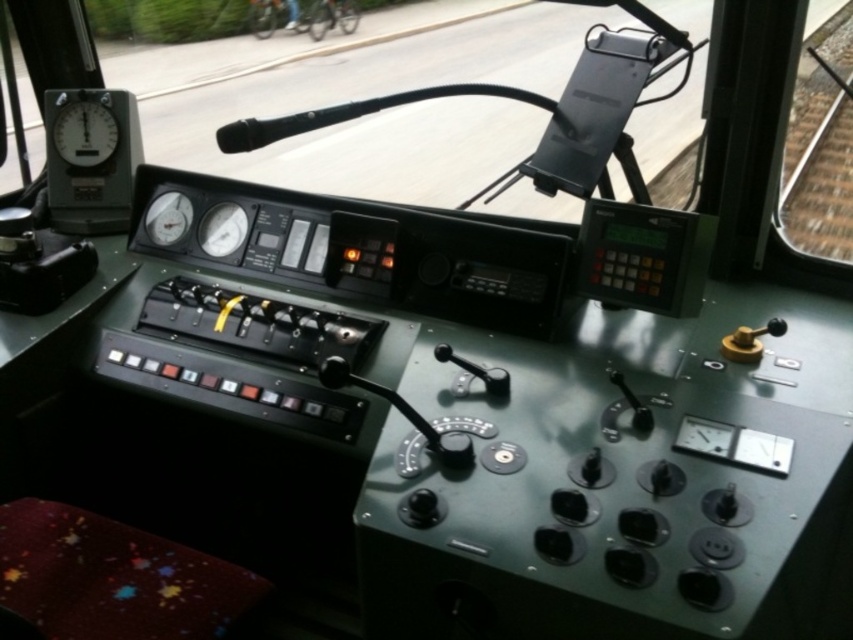
From the picture: You are a train engineer who needs to adjust both the matte black gauge at upper left and the yellow lever centrally. Given that you are standing in front of the control panel, can you reach both controls without moving your position?

The matte black gauge at upper left and the yellow lever centrally are 5.88 feet apart. Since the average human arm span is about 3 feet, you would need to move your position to reach both controls.

You are an engineer in the train cab and need to locate the matte black gauge at upper left and the metallic bicycle at upper center. Which object is positioned to the left of the other?

The metallic bicycle at upper center is to the left of the matte black gauge at upper left.